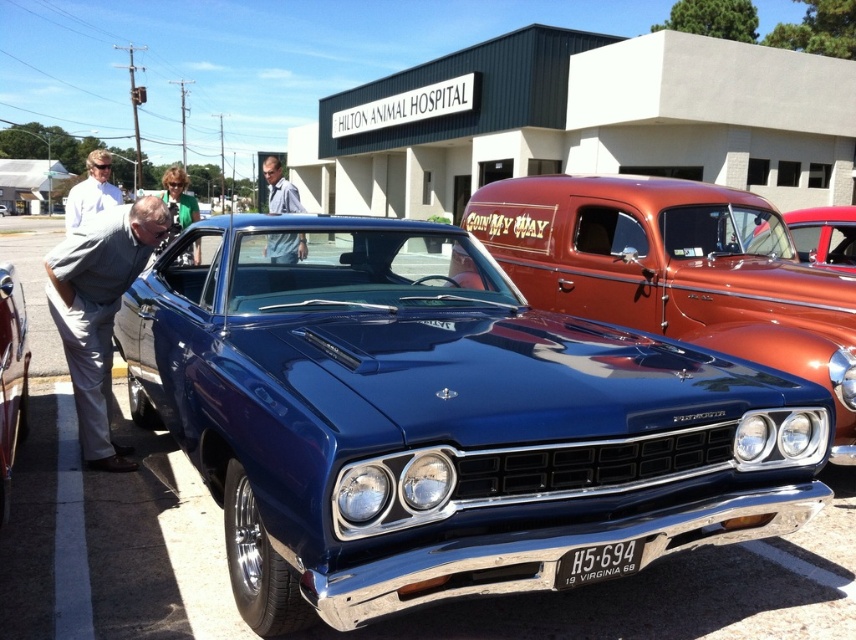
You are standing in front of the classic blue muscle car and notice two points marked on the car. The first point is at coordinates point (0, 284) and the second is at point (69, 196). Which point is closer to you?

Point (0, 284) is closer to the viewer than point (69, 196).

You are a photographer at the car show and need to capture a photo that includes both the metallic blue car at center and the white shirt at left. Can you position yourself so that both are fully visible in the frame without any obstruction?

The metallic blue car at center is in front of the white shirt at left, so positioning yourself behind the metallic blue car at center would allow both to be seen in the frame without obstruction.

You are a delivery person who needs to deliver a package to the Hilton Animal Hospital. You see the metallic blue car at center and the white shirt at left. How far apart are these two objects?

The metallic blue car at center is 12.16 feet away from the white shirt at left.